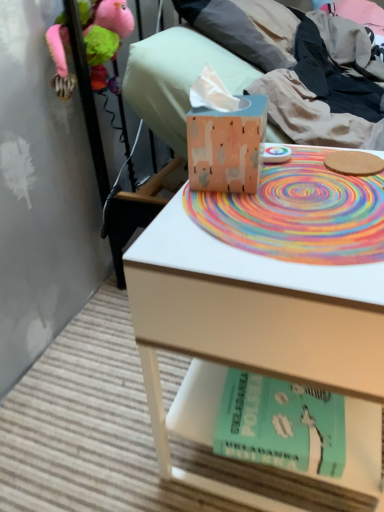
Question: Is matte cardboard tissue box at upper center not close to teal matte paperback book at lower center?

Choices:
 (A) no
 (B) yes

Answer: (A)

Question: From a real-world perspective, is matte cardboard tissue box at upper center under teal matte paperback book at lower center?

Choices:
 (A) yes
 (B) no

Answer: (B)

Question: Considering the relative sizes of matte cardboard tissue box at upper center and teal matte paperback book at lower center in the image provided, is matte cardboard tissue box at upper center bigger than teal matte paperback book at lower center?

Choices:
 (A) yes
 (B) no

Answer: (A)

Question: From a real-world perspective, is matte cardboard tissue box at upper center physically above teal matte paperback book at lower center?

Choices:
 (A) no
 (B) yes

Answer: (B)

Question: From the image's perspective, does matte cardboard tissue box at upper center appear lower than teal matte paperback book at lower center?

Choices:
 (A) no
 (B) yes

Answer: (A)

Question: Could you tell me if matte cardboard tissue box at upper center is facing teal matte paperback book at lower center?

Choices:
 (A) no
 (B) yes

Answer: (A)

Question: From a real-world perspective, is matte cardboard tissue box at upper center physically above wooden tissue box at center?

Choices:
 (A) yes
 (B) no

Answer: (B)

Question: Does matte cardboard tissue box at upper center have a lesser height compared to wooden tissue box at center?

Choices:
 (A) yes
 (B) no

Answer: (B)

Question: From a real-world perspective, is matte cardboard tissue box at upper center physically below wooden tissue box at center?

Choices:
 (A) no
 (B) yes

Answer: (B)

Question: Is matte cardboard tissue box at upper center not within wooden tissue box at center?

Choices:
 (A) no
 (B) yes

Answer: (B)

Question: Is matte cardboard tissue box at upper center to the left of wooden tissue box at center from the viewer's perspective?

Choices:
 (A) no
 (B) yes

Answer: (A)

Question: Is matte cardboard tissue box at upper center closer to the viewer compared to wooden tissue box at center?

Choices:
 (A) no
 (B) yes

Answer: (A)

Question: Does rainbow spiral mat at center have a larger size compared to teal matte paperback book at lower center?

Choices:
 (A) yes
 (B) no

Answer: (B)